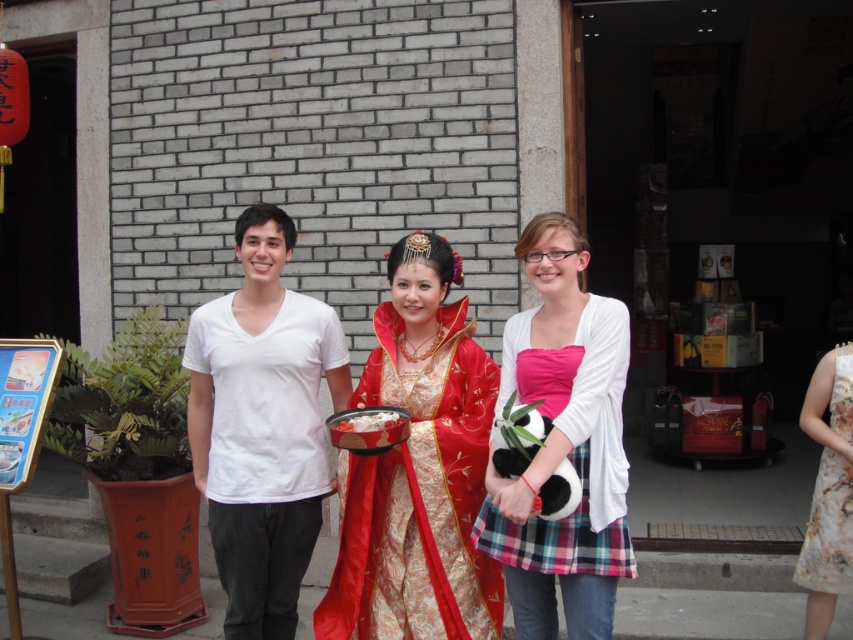
You are organizing a photoshoot and need to arrange the matte gold dress at center and the floral silk dress at right in a way that follows the spatial relationship described. Which dress should be placed to the left of the other?

The matte gold dress at center should be placed to the left of the floral silk dress at right, as it is positioned on the left side of the latter according to the description.